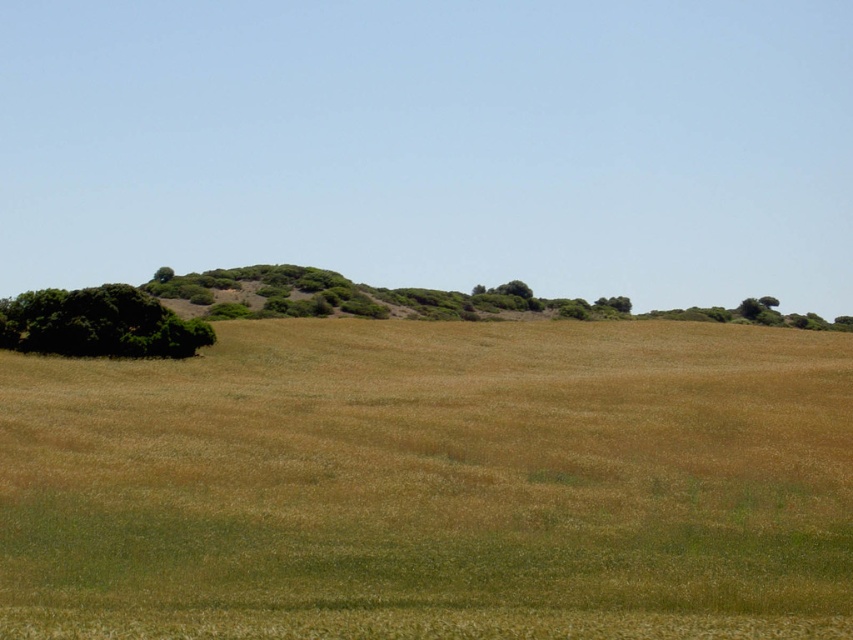
Question: Which point is closer to the camera taking this photo?

Choices:
 (A) (45, 332)
 (B) (469, 470)
 (C) (163, 280)

Answer: (B)

Question: Based on their relative distances, which object is farther from the brown grassy field at center?

Choices:
 (A) green leafy tree at left
 (B) green leafy tree at upper left

Answer: (B)

Question: In this image, where is brown grassy field at center located relative to green leafy tree at left?

Choices:
 (A) below
 (B) above

Answer: (A)

Question: Observing the image, what is the correct spatial positioning of green leafy tree at left in reference to green leafy tree at upper left?

Choices:
 (A) above
 (B) below

Answer: (B)

Question: Which is farther from the green leafy tree at left?

Choices:
 (A) brown grassy field at center
 (B) green leafy tree at upper left

Answer: (B)

Question: Observing the image, what is the correct spatial positioning of brown grassy field at center in reference to green leafy tree at left?

Choices:
 (A) left
 (B) right

Answer: (B)